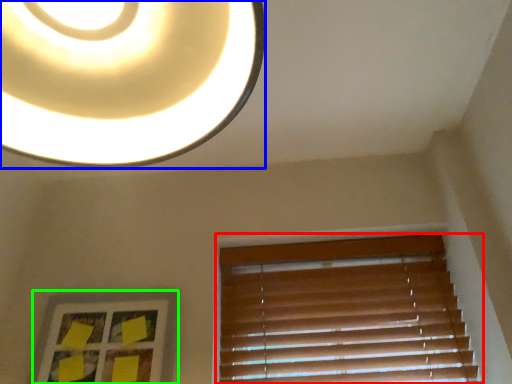
Question: Which is nearer to the window blind (highlighted by a red box)? lamp (highlighted by a blue box) or picture frame (highlighted by a green box).

Choices:
 (A) lamp
 (B) picture frame

Answer: (B)